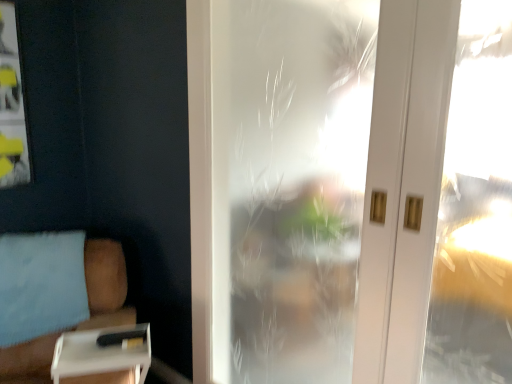
Question: Is white matte box at lower left shorter than frosted glass door at center?

Choices:
 (A) yes
 (B) no

Answer: (A)

Question: Is white matte box at lower left turned away from frosted glass door at center?

Choices:
 (A) no
 (B) yes

Answer: (A)

Question: Is white matte box at lower left closer to camera compared to frosted glass door at center?

Choices:
 (A) yes
 (B) no

Answer: (A)

Question: Can you confirm if white matte box at lower left is wider than frosted glass door at center?

Choices:
 (A) yes
 (B) no

Answer: (A)

Question: Is white matte box at lower left not close to frosted glass door at center?

Choices:
 (A) no
 (B) yes

Answer: (A)

Question: From a real-world perspective, is white matte box at lower left on top of frosted glass door at center?

Choices:
 (A) yes
 (B) no

Answer: (B)

Question: Considering the relative sizes of white matte box at lower left and white plastic tray at lower left in the image provided, is white matte box at lower left wider than white plastic tray at lower left?

Choices:
 (A) yes
 (B) no

Answer: (A)

Question: Considering the relative sizes of white matte box at lower left and white plastic tray at lower left in the image provided, is white matte box at lower left smaller than white plastic tray at lower left?

Choices:
 (A) yes
 (B) no

Answer: (B)

Question: Is white matte box at lower left at the right side of white plastic tray at lower left?

Choices:
 (A) no
 (B) yes

Answer: (A)

Question: Is the position of white matte box at lower left less distant than that of white plastic tray at lower left?

Choices:
 (A) no
 (B) yes

Answer: (B)

Question: Could you tell me if white matte box at lower left is turned towards white plastic tray at lower left?

Choices:
 (A) yes
 (B) no

Answer: (A)

Question: Is white matte box at lower left bigger than white plastic tray at lower left?

Choices:
 (A) no
 (B) yes

Answer: (B)

Question: Does white plastic tray at lower left lie in front of white matte box at lower left?

Choices:
 (A) no
 (B) yes

Answer: (A)